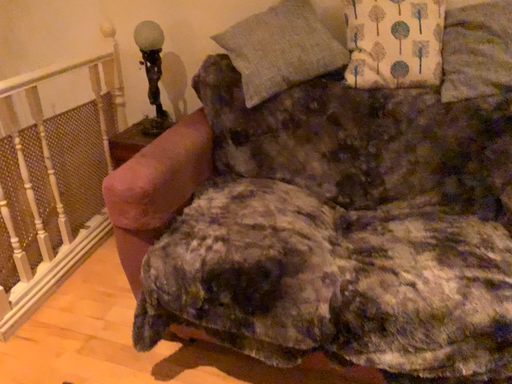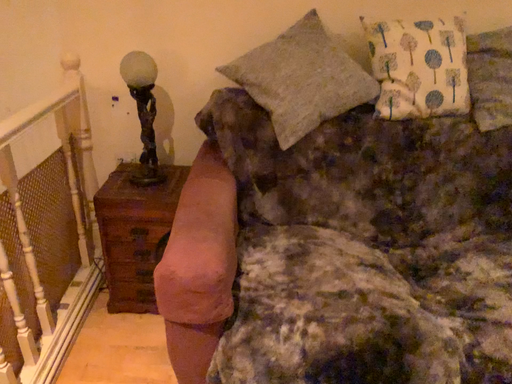
Question: How did the camera likely rotate when shooting the video?

Choices:
 (A) rotated right
 (B) rotated left

Answer: (A)